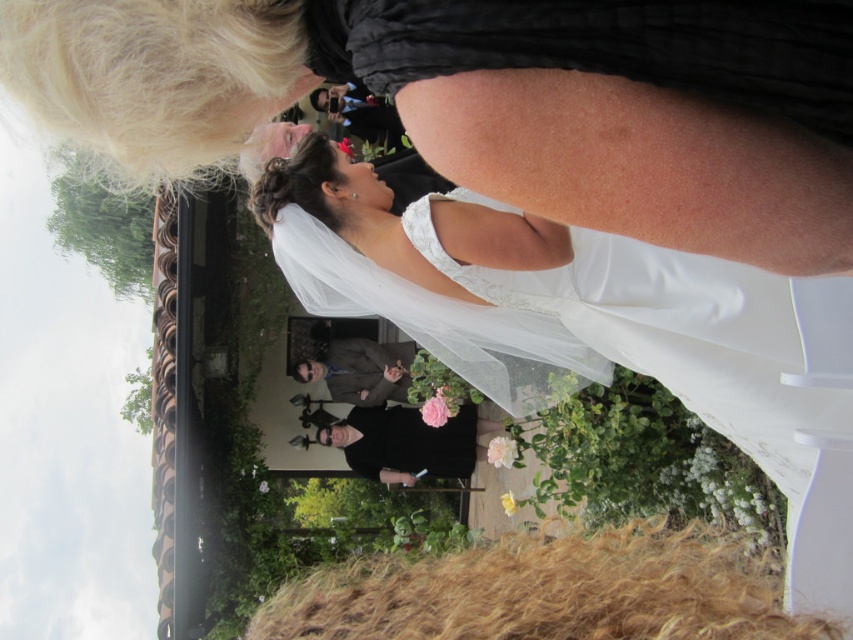
Question: Which of the following is the closest to the observer?

Choices:
 (A) black satin suit at center
 (B) dark gray suit at center

Answer: (A)

Question: Does white lace veil at center come in front of dark gray suit at center?

Choices:
 (A) yes
 (B) no

Answer: (A)

Question: Based on their relative distances, which object is farther from the satin white dress at center?

Choices:
 (A) dark gray suit at center
 (B) black satin suit at center

Answer: (A)

Question: Which point is closer to the camera taking this photo?

Choices:
 (A) (520, 300)
 (B) (57, 102)
 (C) (425, 454)

Answer: (B)

Question: Can you confirm if satin white dress at center is bigger than dark gray suit at center?

Choices:
 (A) no
 (B) yes

Answer: (A)

Question: Does white lace veil at center have a greater width compared to satin white dress at center?

Choices:
 (A) yes
 (B) no

Answer: (A)